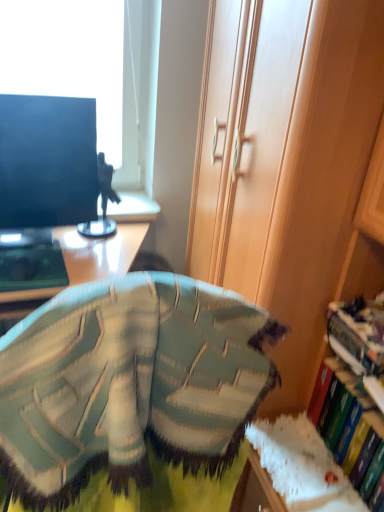
Question: From the image's perspective, is hardcover book at right, which is the 1th book in bottom-to-top order, located above or below matte black monitor at left?

Choices:
 (A) above
 (B) below

Answer: (B)

Question: Looking at their shapes, would you say hardcover book at right, the second book when ordered from top to bottom, is wider or thinner than matte black monitor at left?

Choices:
 (A) thin
 (B) wide

Answer: (B)

Question: Estimate the real-world distances between objects in this image. Which object is closer to the green knitted bean bag chair at center?

Choices:
 (A) matte black monitor at left
 (B) hardcover book at right, which is the 1th book in bottom-to-top order
 (C) wooden cabinet at right
 (D) hardcover book at right, acting as the second book starting from the bottom

Answer: (C)

Question: Which is farther from the hardcover book at right, acting as the second book starting from the bottom?

Choices:
 (A) matte black monitor at left
 (B) hardcover book at right, which is the 1th book in bottom-to-top order
 (C) wooden cabinet at right
 (D) green knitted bean bag chair at center

Answer: (A)